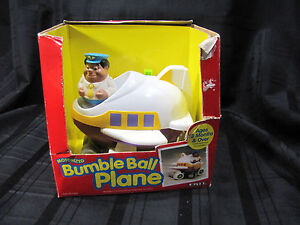
Find the location of a particular element. This screenshot has height=225, width=300. box is located at coordinates (148, 37).